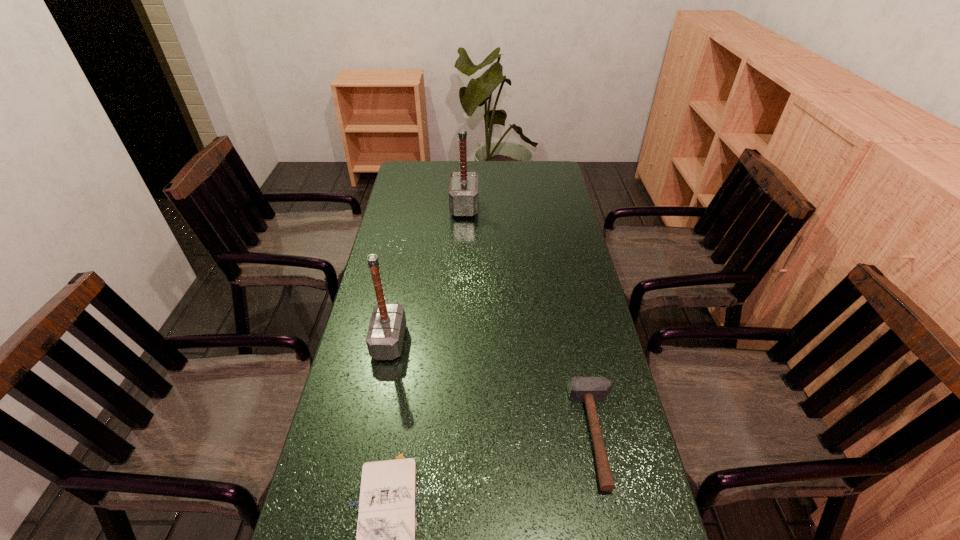
Where is `free space located on the striking surface of the second shortest object`? The width and height of the screenshot is (960, 540). free space located on the striking surface of the second shortest object is located at coordinates (479, 435).

Where is `object located in the left edge section of the desktop`? object located in the left edge section of the desktop is located at coordinates (385, 336).

Find the location of `object at the right edge`. object at the right edge is located at coordinates (580, 389).

Locate an element on the screen. This screenshot has width=960, height=540. free spot at the far edge of the desktop is located at coordinates click(519, 184).

Where is `vacant area at the left edge of the desktop`? vacant area at the left edge of the desktop is located at coordinates (392, 277).

Identify the location of vacant space at the right edge of the desktop. Image resolution: width=960 pixels, height=540 pixels. (586, 303).

What are the coordinates of `free space at the far left corner of the desktop` in the screenshot? It's located at (431, 161).

Locate an element on the screen. Image resolution: width=960 pixels, height=540 pixels. free space between the third object from left to right and the second nearest hammer is located at coordinates (427, 274).

Where is `empty location between the second hammer from left to right and the third nearest object`? empty location between the second hammer from left to right and the third nearest object is located at coordinates pyautogui.click(x=427, y=274).

Where is `unoccupied area between the third object from left to right and the third tallest object`? The width and height of the screenshot is (960, 540). unoccupied area between the third object from left to right and the third tallest object is located at coordinates (532, 321).